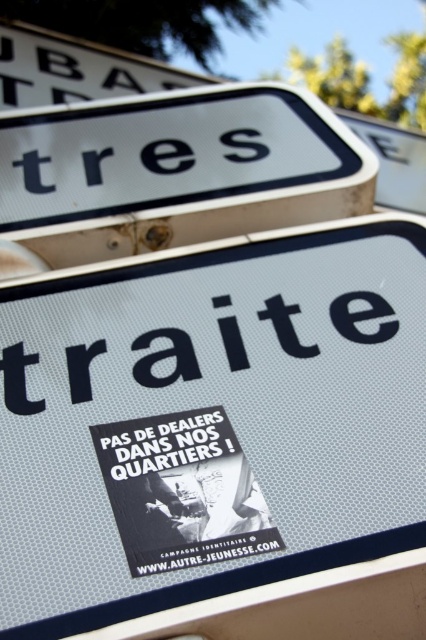
Question: Which point is closer to the camera?

Choices:
 (A) (106, 477)
 (B) (247, 536)
 (C) (97, 561)
 (D) (383, 301)

Answer: (C)

Question: Which point appears farthest from the camera in this image?

Choices:
 (A) (115, 476)
 (B) (267, 547)
 (C) (351, 516)
 (D) (77, 364)

Answer: (D)

Question: Does black plastic text at center appear under black matte text at center?

Choices:
 (A) no
 (B) yes

Answer: (A)

Question: Is white textured sign at center closer to the viewer compared to black paper sticker at center?

Choices:
 (A) yes
 (B) no

Answer: (A)

Question: Does black plastic text at center appear on the right side of black paper sticker at center?

Choices:
 (A) yes
 (B) no

Answer: (A)

Question: Considering the real-world distances, which object is closest to the white textured sign at center?

Choices:
 (A) black paper sticker at center
 (B) black plastic text at center

Answer: (B)